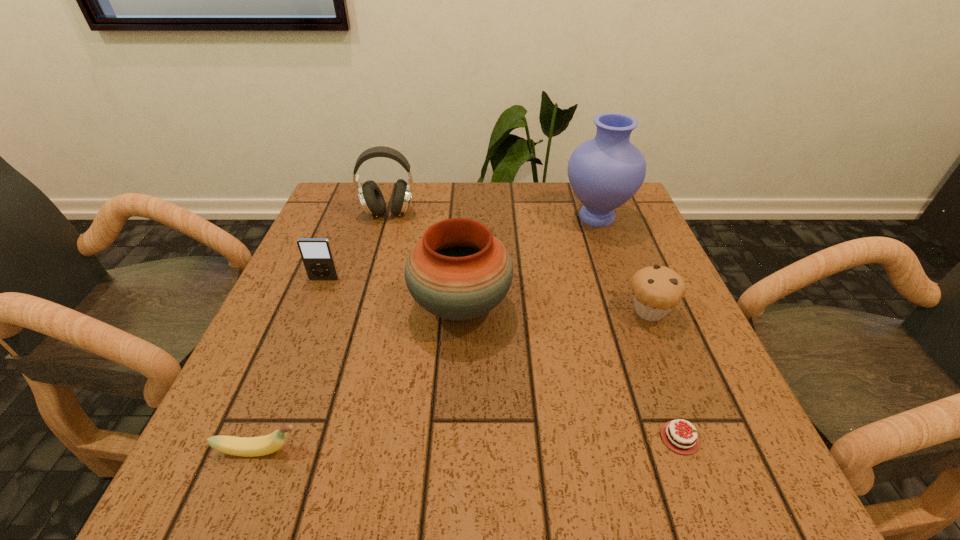
The width and height of the screenshot is (960, 540). I want to click on vase, so click(x=604, y=172).

Where is `headset`? headset is located at coordinates (371, 198).

This screenshot has width=960, height=540. Identify the location of pottery. (458, 271).

Locate an element on the screen. Image resolution: width=960 pixels, height=540 pixels. iPod is located at coordinates (316, 253).

This screenshot has width=960, height=540. Identify the location of muffin. (657, 290).

Find the location of `the second shortest object`. the second shortest object is located at coordinates (263, 445).

In order to click on the shortest object in this screenshot , I will do `click(684, 445)`.

What are the coordinates of `vacant space located on the left of the tallest object` in the screenshot? It's located at (459, 217).

Identify the location of vacant space located on the ear cups of the headset. (382, 237).

Identify the location of free spot located on the front of the fourth object from left to right. This screenshot has height=540, width=960. (457, 375).